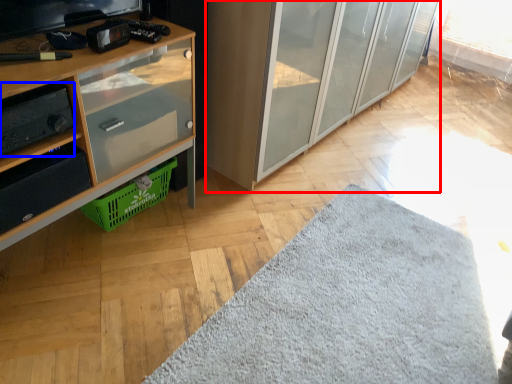
Question: Which point is further to the camera, cabinetry (highlighted by a red box) or stereo (highlighted by a blue box)?

Choices:
 (A) cabinetry
 (B) stereo

Answer: (A)